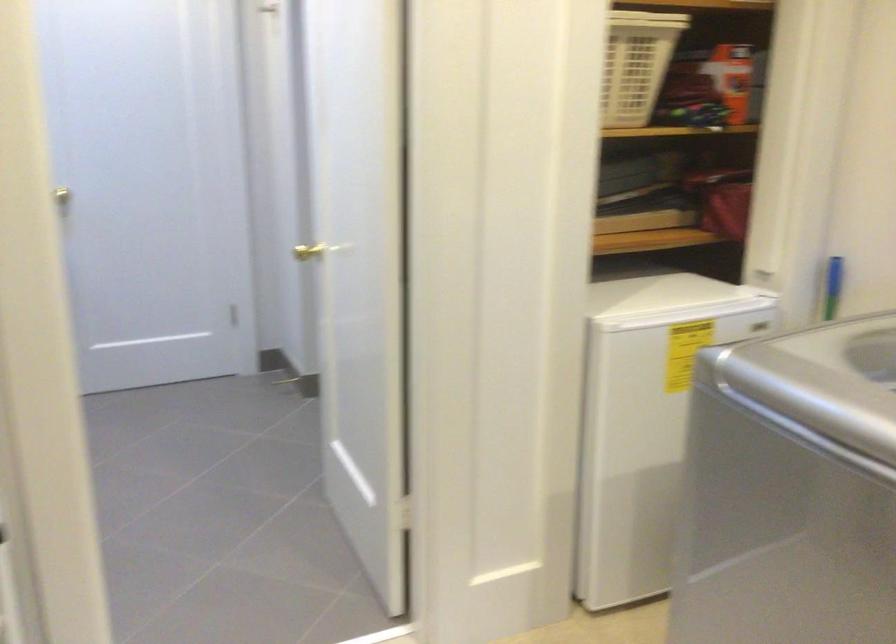
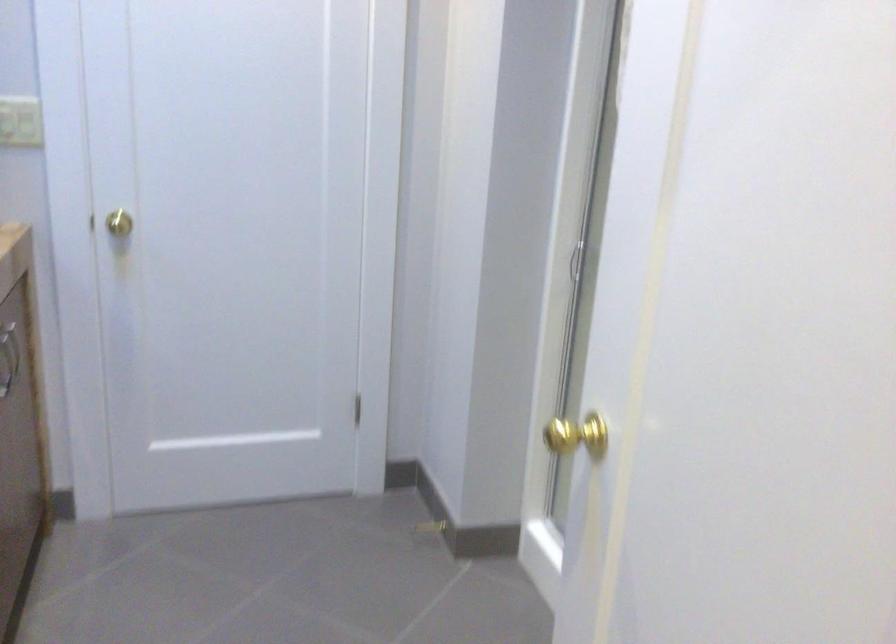
What movement of the cameraman would produce the second image?

The cameraman walked toward left, forward.